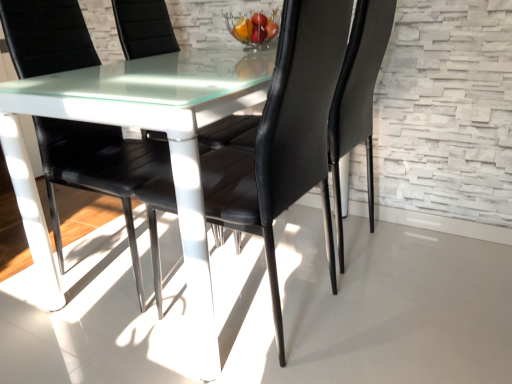
Locate an element on the screen. The image size is (512, 384). unoccupied region to the right of black leather chair at center, which ranks as the third chair in left-to-right order is located at coordinates (395, 312).